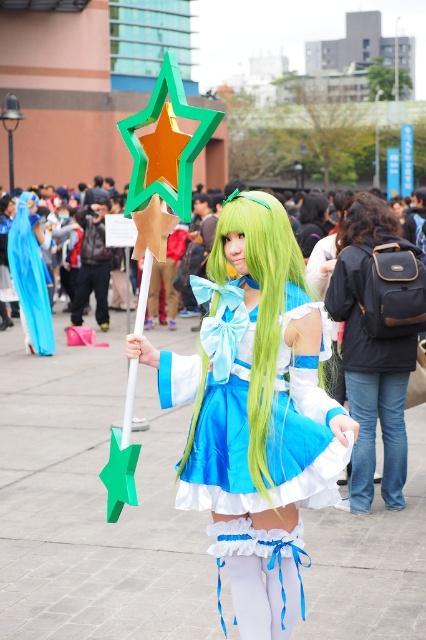
You are a photographer at the event and want to capture the person in the matte blue dress at center and the black leather backpack at right in a single frame. Given that your camera has a fixed focal length and limited field of view, which object should you position closer to the camera to ensure both are fully visible?

Since the matte blue dress at center is wider than the black leather backpack at right, you should position the matte blue dress at center closer to the camera. This will help ensure both objects fit within the frame while maintaining their visibility.

You are taking a photo of the person holding the star staff. You want to focus on the gold center of the star on the staff. Which of the two points, point (276, 577) or point (367, 230), is closer to the camera and thus better for focusing?

Point (276, 577) is closer to the camera than point (367, 230), so it is better for focusing on the gold center of the star on the staff.

You are a photographer at a costume party and want to take a photo of the person with both green silky hair at center and dark brown curly hair at center. Which hair is larger in size?

The green silky hair at center is bigger than the dark brown curly hair at center.